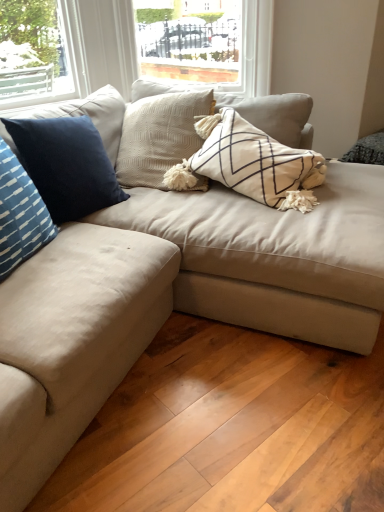
Question: Is suede beige couch at center wider than blue striped pillow at left, arranged as the second pillow when viewed from the back?

Choices:
 (A) no
 (B) yes

Answer: (B)

Question: Would you consider suede beige couch at center to be distant from blue striped pillow at left, arranged as the second pillow when viewed from the back?

Choices:
 (A) yes
 (B) no

Answer: (B)

Question: Considering the relative sizes of suede beige couch at center and blue striped pillow at left, the 1th pillow viewed from the front, in the image provided, is suede beige couch at center shorter than blue striped pillow at left, the 1th pillow viewed from the front,?

Choices:
 (A) yes
 (B) no

Answer: (B)

Question: Can you confirm if suede beige couch at center is taller than blue striped pillow at left, the 1th pillow viewed from the front?

Choices:
 (A) no
 (B) yes

Answer: (B)

Question: From a real-world perspective, does suede beige couch at center sit lower than blue striped pillow at left, the 1th pillow viewed from the front?

Choices:
 (A) yes
 (B) no

Answer: (A)

Question: Is blue velvet pillow at left, which ranks as the first pillow in back-to-front order, taller or shorter than blue striped pillow at left, the 1th pillow viewed from the front?

Choices:
 (A) short
 (B) tall

Answer: (B)

Question: Looking at their shapes, would you say blue velvet pillow at left, which ranks as the first pillow in back-to-front order, is wider or thinner than blue striped pillow at left, the 1th pillow viewed from the front?

Choices:
 (A) thin
 (B) wide

Answer: (A)

Question: From a real-world perspective, is blue velvet pillow at left, the 2th pillow in the front-to-back sequence, positioned above or below blue striped pillow at left, the 1th pillow viewed from the front?

Choices:
 (A) above
 (B) below

Answer: (B)

Question: Visually, is blue velvet pillow at left, the 2th pillow in the front-to-back sequence, positioned to the left or to the right of blue striped pillow at left, the 1th pillow viewed from the front?

Choices:
 (A) right
 (B) left

Answer: (A)

Question: Considering their positions, is suede beige couch at center located in front of or behind blue velvet pillow at left, the 2th pillow in the front-to-back sequence?

Choices:
 (A) behind
 (B) front

Answer: (B)

Question: From a real-world perspective, is suede beige couch at center positioned above or below blue velvet pillow at left, the 2th pillow in the front-to-back sequence?

Choices:
 (A) above
 (B) below

Answer: (B)

Question: From their relative heights in the image, would you say suede beige couch at center is taller or shorter than blue velvet pillow at left, the 2th pillow in the front-to-back sequence?

Choices:
 (A) tall
 (B) short

Answer: (A)

Question: From the image's perspective, is suede beige couch at center above or below blue velvet pillow at left, the 2th pillow in the front-to-back sequence?

Choices:
 (A) below
 (B) above

Answer: (A)

Question: Considering the positions of blue velvet pillow at left, the 2th pillow in the front-to-back sequence, and suede beige couch at center in the image, is blue velvet pillow at left, the 2th pillow in the front-to-back sequence, bigger or smaller than suede beige couch at center?

Choices:
 (A) small
 (B) big

Answer: (A)

Question: In terms of height, does blue velvet pillow at left, the 2th pillow in the front-to-back sequence, look taller or shorter compared to suede beige couch at center?

Choices:
 (A) short
 (B) tall

Answer: (A)